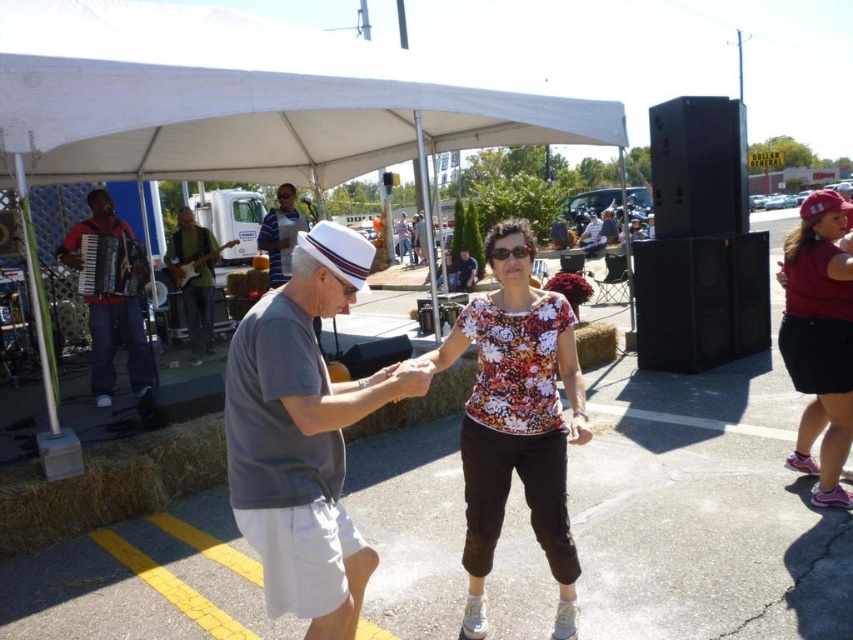
Who is lower down, gray cotton shirt at center or wooden electric guitar at center?

gray cotton shirt at center is lower down.

Can you confirm if gray cotton shirt at center is bigger than wooden electric guitar at center?

Incorrect, gray cotton shirt at center is not larger than wooden electric guitar at center.

Describe the element at coordinates (303, 435) in the screenshot. I see `gray cotton shirt at center` at that location.

Identify the location of gray cotton shirt at center. This screenshot has width=853, height=640. (303, 435).

Can you confirm if matte black accordion at left is smaller than matte black guitar at center?

Yes.

You are a GUI agent. You are given a task and a screenshot of the screen. Output one action in this format:
    pyautogui.click(x=<x>, y=<y>)
    Task: Click on the matte black accordion at left
    The width and height of the screenshot is (853, 640).
    Given the screenshot: What is the action you would take?
    pyautogui.click(x=112, y=344)

Is point (9, 45) positioned after point (399, 218)?

No, (9, 45) is closer to viewer.

Can you confirm if white fabric tent at upper center is wider than matte black guitar at center?

Indeed, white fabric tent at upper center has a greater width compared to matte black guitar at center.

Describe the element at coordinates (239, 100) in the screenshot. I see `white fabric tent at upper center` at that location.

Find the location of a particular element. white fabric tent at upper center is located at coordinates (239, 100).